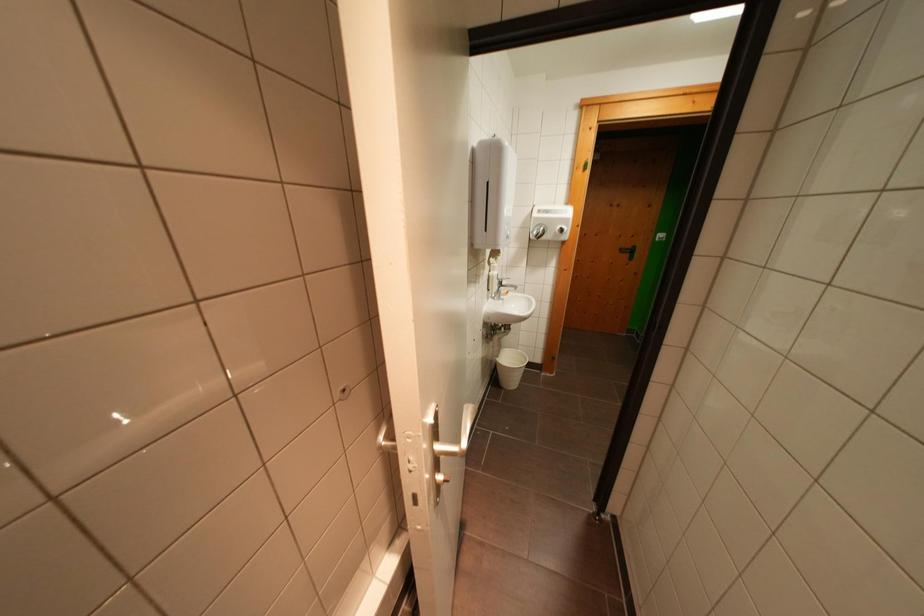
Find where to lift the silver faucet handle. Please return your answer as a coordinate pair (x, y).

(500, 281)